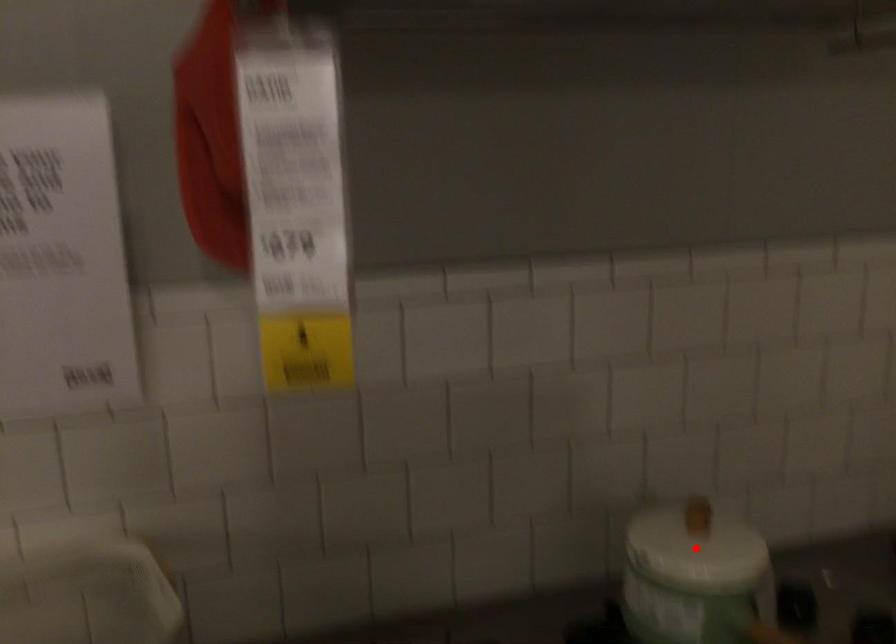
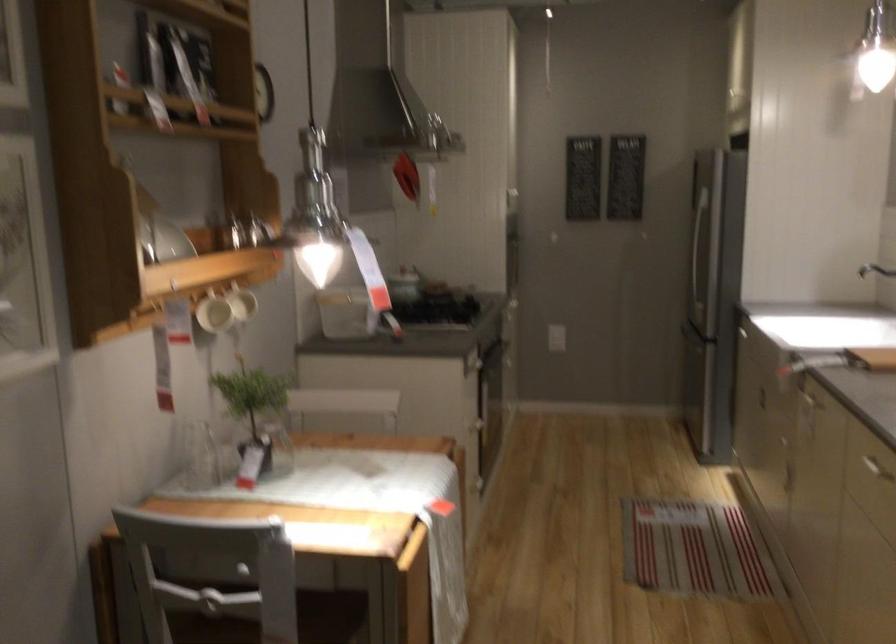
Question: I am providing you with two images of the same scene from different viewpoints. A red point is marked on the first image. Is the red point's position out of view in image 2?

Choices:
 (A) Yes
 (B) No

Answer: (A)